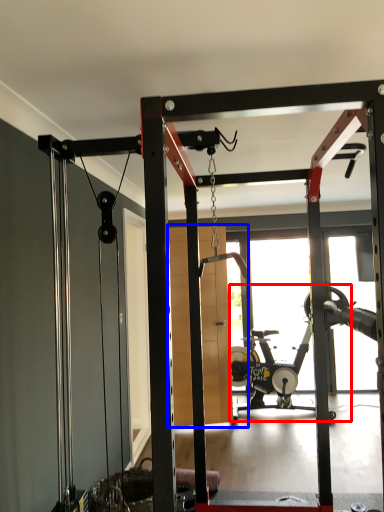
Question: Which object appears closest to the camera in this image, stationary bicycle (highlighted by a red box) or garage door (highlighted by a blue box)?

Choices:
 (A) stationary bicycle
 (B) garage door

Answer: (B)